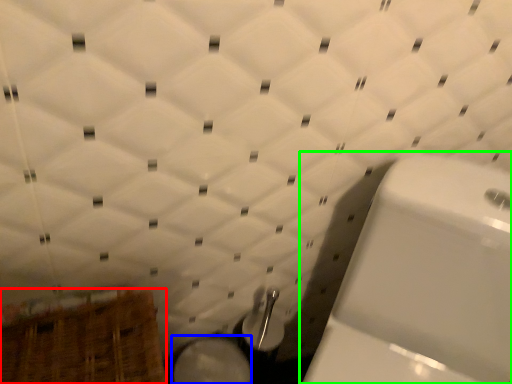
Question: Which object is the closest to the basket (highlighted by a red box)? Choose among these: bidet (highlighted by a blue box) or toilet (highlighted by a green box).

Choices:
 (A) bidet
 (B) toilet

Answer: (A)